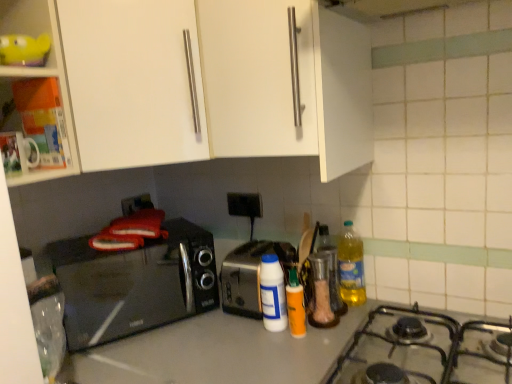
At what (x,y) coordinates should I click in order to perform the action: click on free spot in front of clear glass container at center. Please return your answer as a coordinate pair (x, y). This screenshot has height=384, width=512. Looking at the image, I should click on (312, 343).